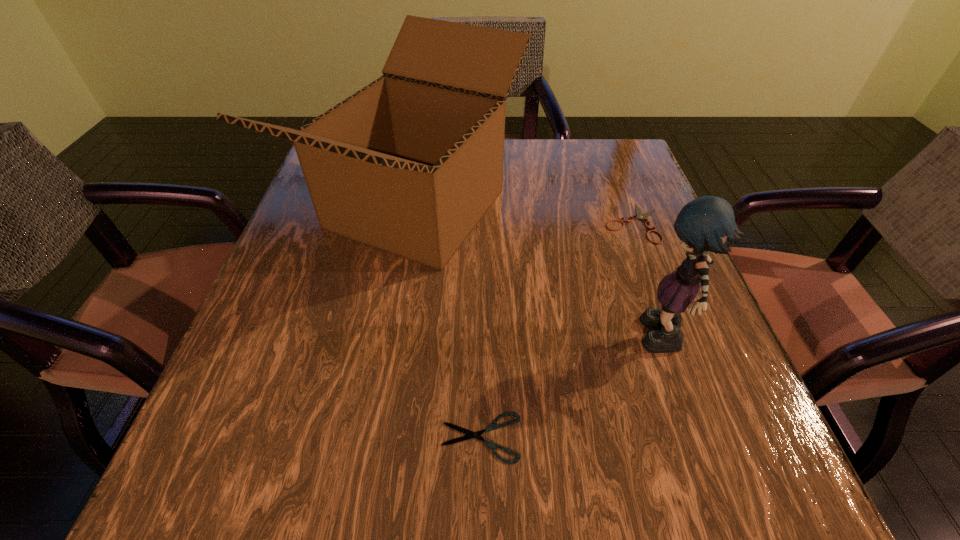
You are a GUI agent. You are given a task and a screenshot of the screen. Output one action in this format:
    pyautogui.click(x=<x>, y=<y>)
    Task: Click on the box
    The height and width of the screenshot is (540, 960).
    Given the screenshot: What is the action you would take?
    pyautogui.click(x=409, y=164)

Locate an element on the screen. rag doll is located at coordinates (707, 223).

The image size is (960, 540). Find the location of `the farther shears`. the farther shears is located at coordinates (641, 216).

In order to click on the third tallest object in this screenshot , I will do `click(641, 216)`.

The height and width of the screenshot is (540, 960). Find the location of `the nearest object`. the nearest object is located at coordinates (470, 434).

Locate an element on the screen. This screenshot has height=540, width=960. the nearer shears is located at coordinates (470, 434).

What are the coordinates of `free spot located on the front of the box` in the screenshot? It's located at (383, 413).

The image size is (960, 540). Identify the location of vacant space located on the front-facing side of the rag doll. (495, 342).

The height and width of the screenshot is (540, 960). Find the location of `free location located 0.400m on the front-facing side of the rag doll`. free location located 0.400m on the front-facing side of the rag doll is located at coordinates (391, 342).

Where is `free space located 0.200m on the front-facing side of the rag doll`? The width and height of the screenshot is (960, 540). free space located 0.200m on the front-facing side of the rag doll is located at coordinates (515, 342).